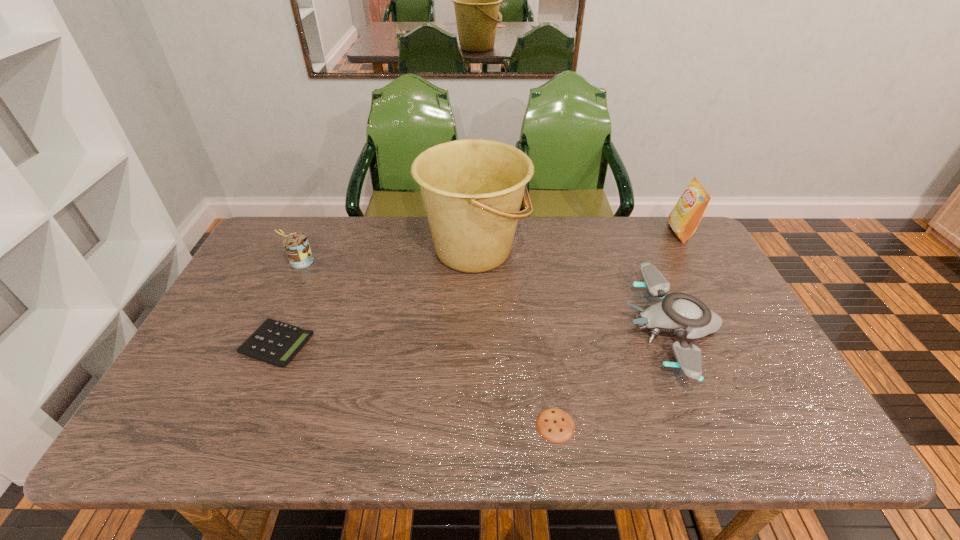
The height and width of the screenshot is (540, 960). I want to click on vacant area that lies between the tallest object and the third shortest object, so click(x=572, y=289).

I want to click on vacant region between the tallest object and the can, so click(x=387, y=256).

Select which object is the fourth closest to the tallest object. Please provide its 2D coordinates. Your answer should be formatted as a tuple, i.e. [(x, y)], where the tuple contains the x and y coordinates of a point satisfying the conditions above.

[(555, 425)]

Identify which object is the second closest to the bucket. Please provide its 2D coordinates. Your answer should be formatted as a tuple, i.e. [(x, y)], where the tuple contains the x and y coordinates of a point satisfying the conditions above.

[(274, 342)]

This screenshot has width=960, height=540. I want to click on vacant area that satisfies the following two spatial constraints: 1. on the front side of the shortest object; 2. on the left side of the calculator, so click(x=242, y=425).

You are a GUI agent. You are given a task and a screenshot of the screen. Output one action in this format:
    pyautogui.click(x=<x>, y=<y>)
    Task: Click on the free spot that satisfies the following two spatial constraints: 1. on the front side of the third tallest object; 2. on the left side of the nearest object
    
    Given the screenshot: What is the action you would take?
    pyautogui.click(x=225, y=425)

Locate an element on the screen. The width and height of the screenshot is (960, 540). free space that satisfies the following two spatial constraints: 1. on the front side of the shortest object; 2. on the left side of the calculator is located at coordinates (242, 425).